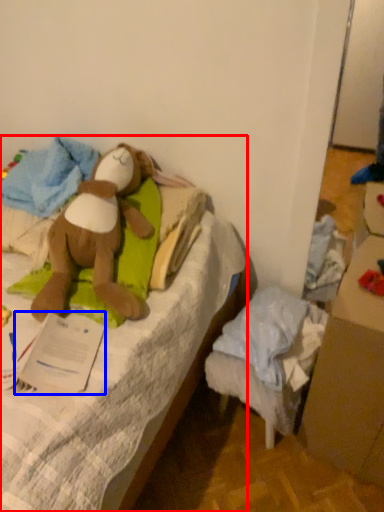
Question: Which point is further to the camera, furniture (highlighted by a red box) or paper (highlighted by a blue box)?

Choices:
 (A) furniture
 (B) paper

Answer: (B)